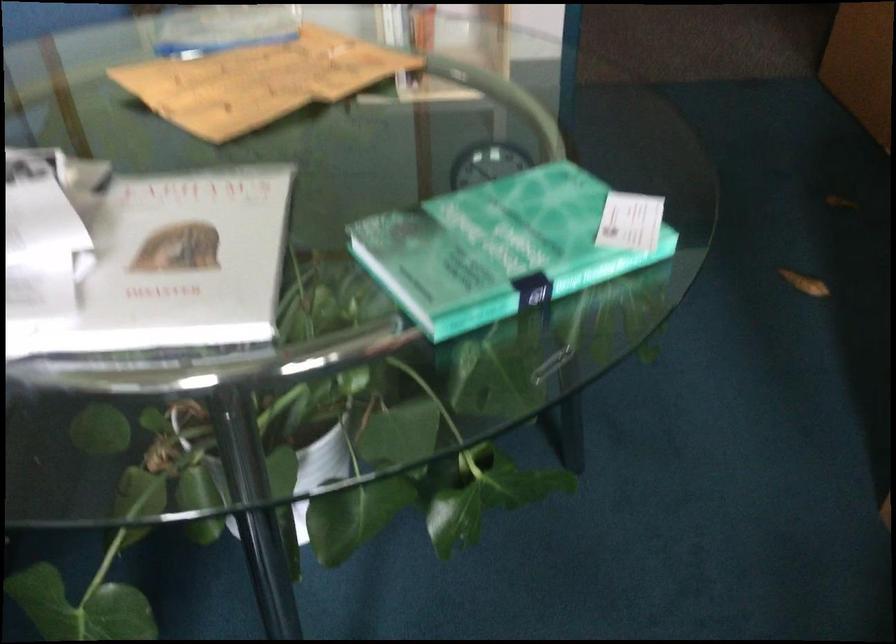
Find where to lift the green cover book. Please return your answer as a coordinate pair (x, y).

(495, 247)